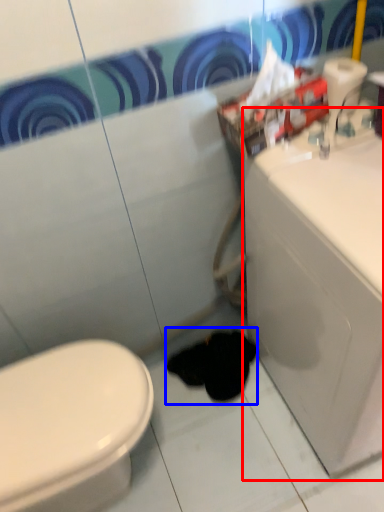
Question: Which of the following is the closest to the observer, porcelain (highlighted by a red box) or animal (highlighted by a blue box)?

Choices:
 (A) porcelain
 (B) animal

Answer: (A)